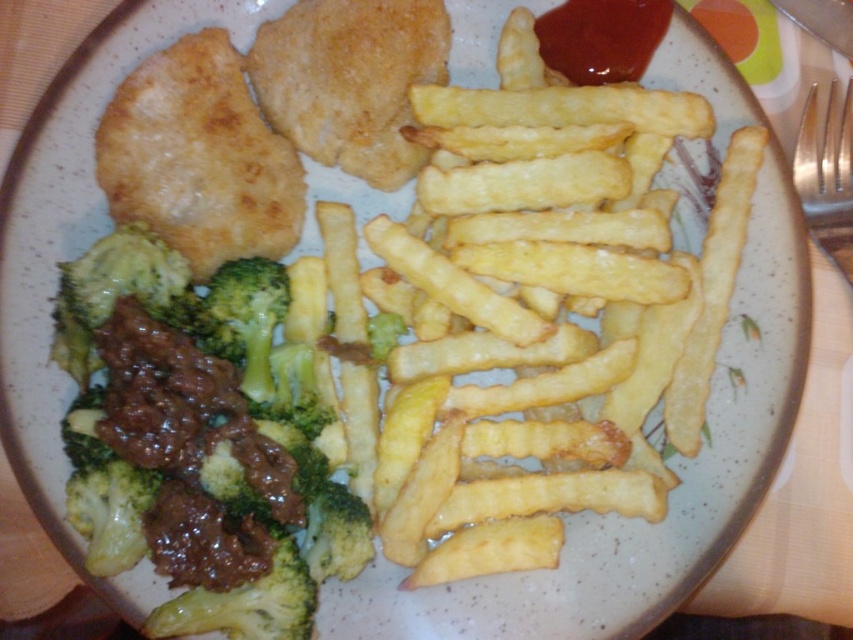
Question: Can you confirm if shiny red sauce at top right is thinner than green matte broccoli at center-left?

Choices:
 (A) yes
 (B) no

Answer: (B)

Question: Can you confirm if green matte broccoli at center is positioned to the right of shiny red sauce at top right?

Choices:
 (A) no
 (B) yes

Answer: (A)

Question: Which object appears farthest from the camera in this image?

Choices:
 (A) silver metallic fork at upper right
 (B) green matte broccoli at center-left

Answer: (A)

Question: Which point appears closest to the camera in this image?

Choices:
 (A) (265, 371)
 (B) (196, 605)
 (C) (235, 472)
 (D) (596, 49)

Answer: (B)

Question: Considering the relative positions of green matte broccoli at lower left and green matte broccoli at center in the image provided, where is green matte broccoli at lower left located with respect to green matte broccoli at center?

Choices:
 (A) right
 (B) left

Answer: (B)

Question: Which is nearer to the silver metallic fork at upper right?

Choices:
 (A) golden crispy fries at center
 (B) green matte broccoli at lower left
 (C) green matte broccoli at center
 (D) green matte broccoli at center-left

Answer: (A)